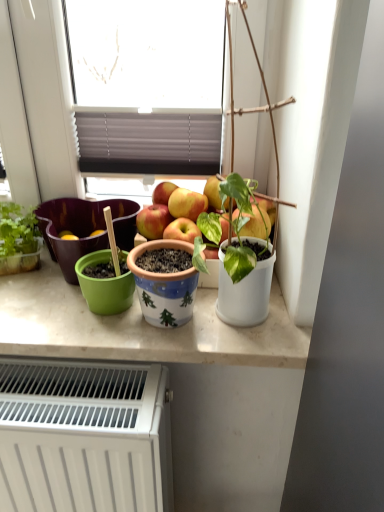
Question: Does blue ceramic pot at center, which is the second flowerpot in left-to-right order, have a larger size compared to white matte pot at right?

Choices:
 (A) yes
 (B) no

Answer: (B)

Question: Considering the relative positions of blue ceramic pot at center, arranged as the 1th flowerpot when viewed from the front, and white matte pot at right in the image provided, is blue ceramic pot at center, arranged as the 1th flowerpot when viewed from the front, to the right of white matte pot at right from the viewer's perspective?

Choices:
 (A) no
 (B) yes

Answer: (A)

Question: Is blue ceramic pot at center, which is the second flowerpot in left-to-right order, looking in the opposite direction of white matte pot at right?

Choices:
 (A) no
 (B) yes

Answer: (A)

Question: From the image's perspective, does blue ceramic pot at center, the 2th flowerpot when ordered from back to front, appear lower than white matte pot at right?

Choices:
 (A) yes
 (B) no

Answer: (A)

Question: Is blue ceramic pot at center, the 2th flowerpot when ordered from back to front, further to the viewer compared to white matte pot at right?

Choices:
 (A) no
 (B) yes

Answer: (B)

Question: Looking at the image, does white matte pot at right seem bigger or smaller compared to white glossy countertop at center?

Choices:
 (A) small
 (B) big

Answer: (B)

Question: Is white matte pot at right to the left or to the right of white glossy countertop at center in the image?

Choices:
 (A) left
 (B) right

Answer: (B)

Question: Considering the positions of white matte pot at right and white glossy countertop at center in the image, is white matte pot at right wider or thinner than white glossy countertop at center?

Choices:
 (A) thin
 (B) wide

Answer: (A)

Question: From a real-world perspective, relative to white glossy countertop at center, is white matte pot at right vertically above or below?

Choices:
 (A) below
 (B) above

Answer: (B)

Question: Is blue ceramic pot at center, the 2th flowerpot when ordered from back to front, situated inside white glossy countertop at center or outside?

Choices:
 (A) inside
 (B) outside

Answer: (B)

Question: From the image's perspective, is blue ceramic pot at center, the 2th flowerpot when ordered from back to front, above or below white glossy countertop at center?

Choices:
 (A) below
 (B) above

Answer: (B)

Question: In the image, is blue ceramic pot at center, which is the second flowerpot in left-to-right order, on the left side or the right side of white glossy countertop at center?

Choices:
 (A) left
 (B) right

Answer: (B)

Question: From a real-world perspective, is blue ceramic pot at center, the 2th flowerpot when ordered from back to front, positioned above or below white glossy countertop at center?

Choices:
 (A) above
 (B) below

Answer: (A)

Question: Considering the positions of blue ceramic pot at center, the 2th flowerpot when ordered from back to front, and white matte pot at right in the image, is blue ceramic pot at center, the 2th flowerpot when ordered from back to front, taller or shorter than white matte pot at right?

Choices:
 (A) tall
 (B) short

Answer: (B)

Question: Which is correct: blue ceramic pot at center, arranged as the 1th flowerpot when viewed from the front, is inside white matte pot at right, or outside of it?

Choices:
 (A) outside
 (B) inside

Answer: (A)